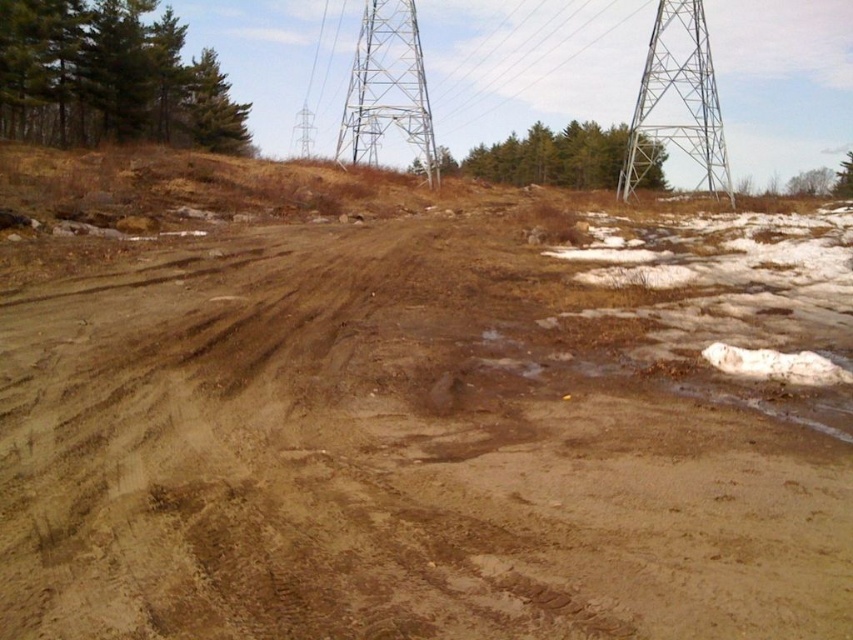
You are a surveyor trying to determine the elevation differences in this area. Based on the image, which object is lower in elevation between the brown dirt field at center and the metallic silver tower at upper right?

The brown dirt field at center has a lesser height compared to the metallic silver tower at upper right, so the brown dirt field at center is lower in elevation.

You are a delivery drone operator trying to navigate through a rural area. Your drone has a maximum flight height of 150 feet. You see the metallic silver tower at upper center and the metallic silver power line at upper center in the image. Can your drone safely fly between them without exceeding its height limit?

The metallic silver tower at upper center and metallic silver power line at upper center are 162.93 feet apart from each other. Since your drone can fly up to 150 feet, it cannot safely navigate between them as the distance between the two objects exceeds the drone height limit.

Based on the photo, you are a photographer setting up equipment in the rugged outdoor scene. You notice the metallic silver tower at upper center and the metallic silver power line at upper center. Which object appears narrower when viewed from your position?

The metallic silver tower at upper center appears narrower than the metallic silver power line at upper center.